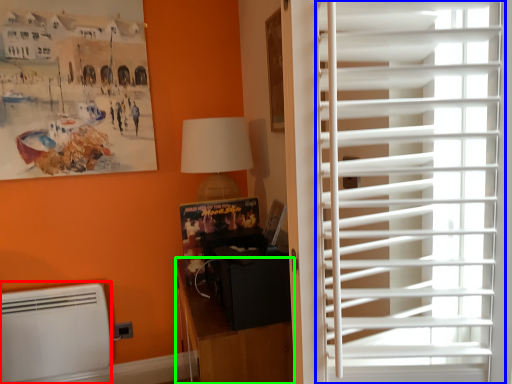
Question: Which is nearer to the air conditioning (highlighted by a red box)? window blind (highlighted by a blue box) or furniture (highlighted by a green box).

Choices:
 (A) window blind
 (B) furniture

Answer: (B)